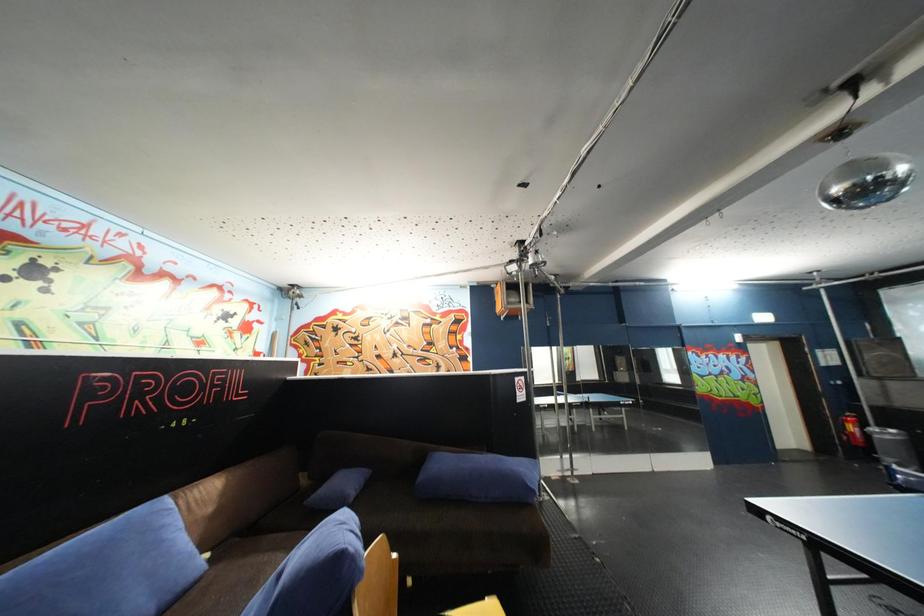
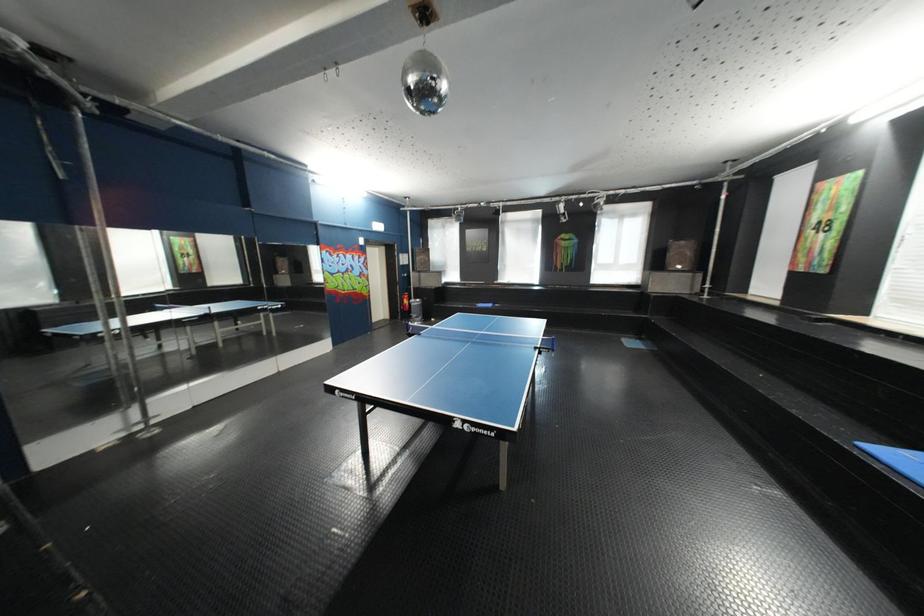
Question: The camera is either moving clockwise (left) or counter-clockwise (right) around the object. The first image is from the beginning of the video and the second image is from the end. Is the camera moving left or right when shooting the video?

Choices:
 (A) Left
 (B) Right

Answer: (A)